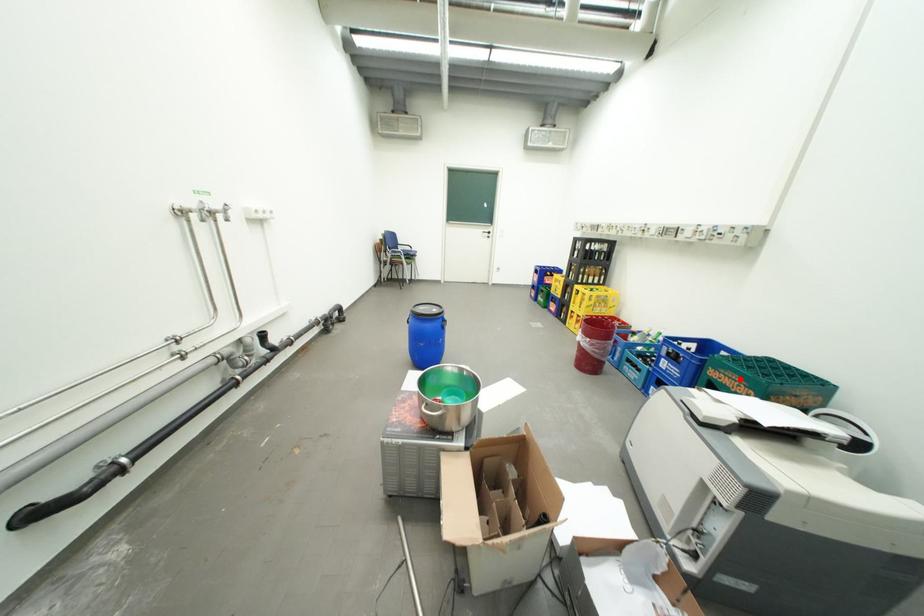
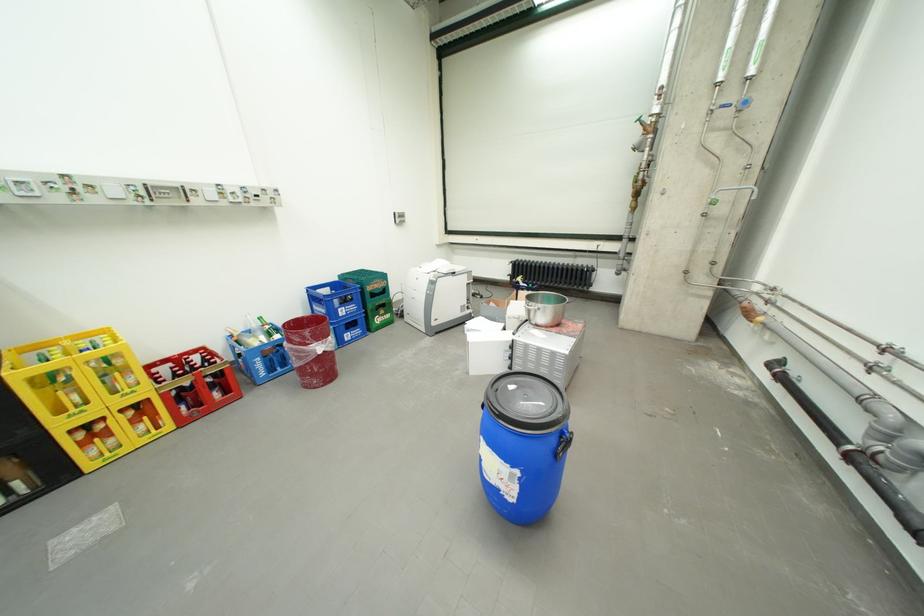
Question: I am providing you with two images of the same scene from different viewpoints. A red point is marked on the first image. Is the red point's position out of view in image 2?

Choices:
 (A) Yes
 (B) No

Answer: (B)